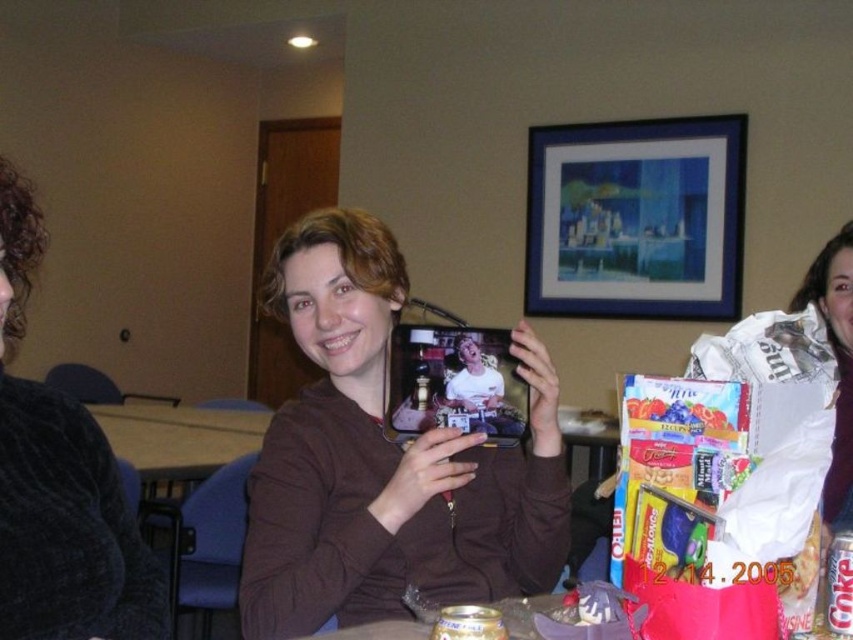
Between brown fabric table at lower left and white cotton shirt at center, which one is positioned lower?

brown fabric table at lower left is below.

Does brown fabric table at lower left have a larger size compared to white cotton shirt at center?

No, brown fabric table at lower left is not bigger than white cotton shirt at center.

The image size is (853, 640). I want to click on brown fabric table at lower left, so click(178, 440).

This screenshot has height=640, width=853. Identify the location of brown fabric table at lower left. (178, 440).

Which is in front, point (96, 556) or point (426, 420)?

Point (96, 556)

Does dark brown sweater at upper center have a lesser width compared to metallic photo frame at center?

No, dark brown sweater at upper center is not thinner than metallic photo frame at center.

Which is in front, point (51, 417) or point (415, 394)?

Point (51, 417)

Where is `dark brown sweater at upper center`? This screenshot has width=853, height=640. dark brown sweater at upper center is located at coordinates (59, 484).

The width and height of the screenshot is (853, 640). In order to click on blue matte picture frame at upper center in this screenshot , I will do click(x=636, y=218).

Which is more to the left, blue matte picture frame at upper center or dark brown sweater at upper center?

From the viewer's perspective, dark brown sweater at upper center appears more on the left side.

At what (x,y) coordinates should I click in order to perform the action: click on blue matte picture frame at upper center. Please return your answer as a coordinate pair (x, y). The image size is (853, 640). Looking at the image, I should click on (636, 218).

This screenshot has height=640, width=853. Identify the location of blue matte picture frame at upper center. pyautogui.click(x=636, y=218).